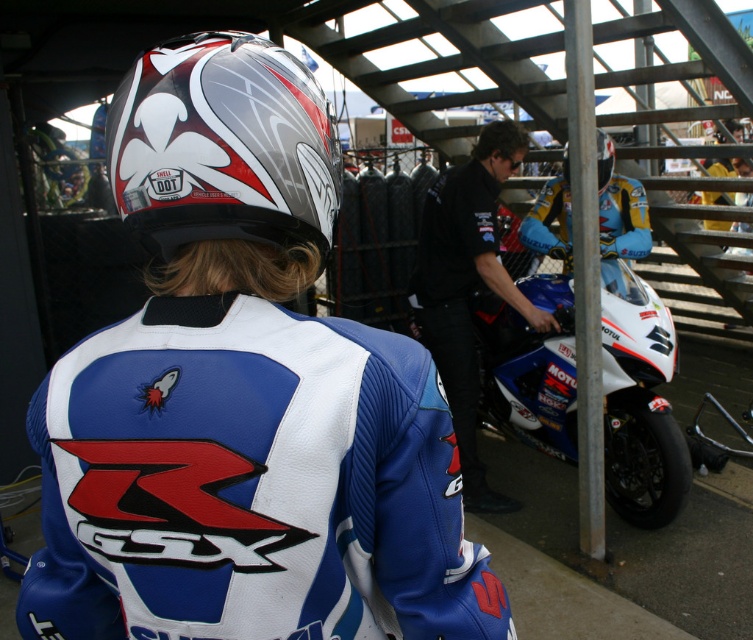
You are a pit crew member and need to quickly grab either the shiny silver helmet at upper center or the black leather jacket at center. Which item can you grab more easily if you need something compact to carry?

The shiny silver helmet at upper center is thinner than the black leather jacket at center, so it can be grabbed more easily as it is more compact.

You are a race team manager checking the pit area. You need to locate the shiny silver helmet at upper center. According to the coordinates provided, where exactly is it positioned?

The shiny silver helmet at upper center is positioned at coordinates point (223, 145).

From the picture: Where is the white and blue leather jacket at center located in the image?

The white and blue leather jacket at center is located at point coordinates of 0.622 on the x axis and 0.324 on the y axis.